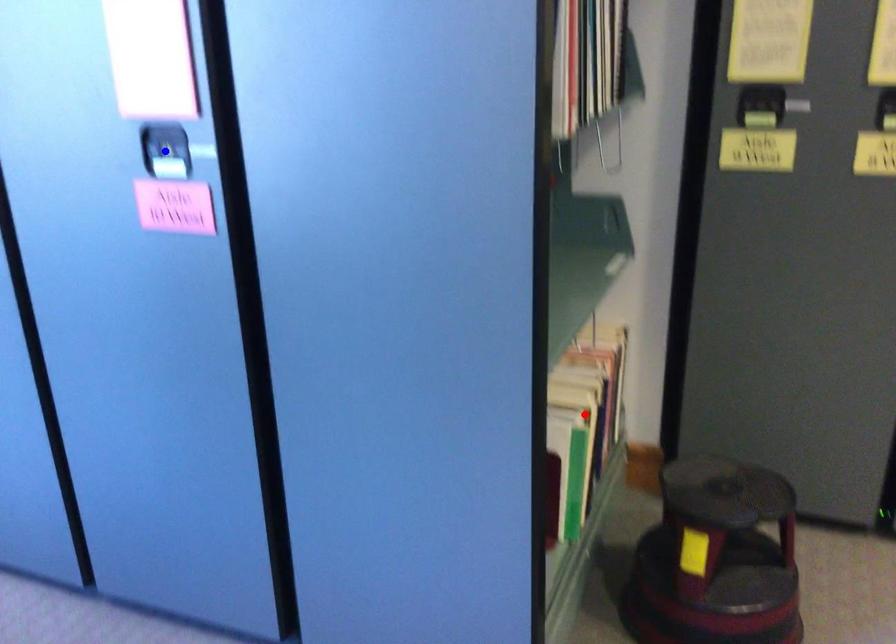
Question: Two points are marked on the image. Which point is closer to the camera?

Choices:
 (A) Blue point is closer.
 (B) Red point is closer.

Answer: (A)